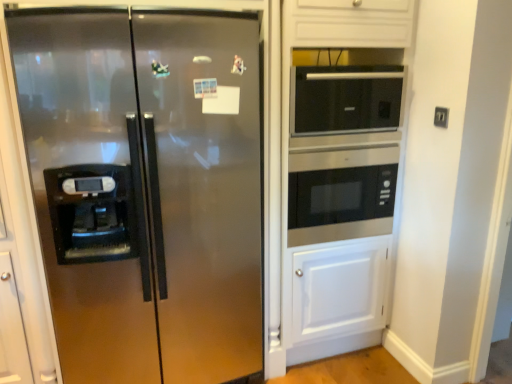
Measure the distance between point (x=306, y=78) and camera.

Point (x=306, y=78) is 1.89 meters from camera.

In order to click on black glass microwave at upper right, which appears as the 2th microwave oven when ordered from the bottom in this screenshot , I will do `click(345, 98)`.

Identify the location of stainless steel refrigerator at left. The height and width of the screenshot is (384, 512). (146, 188).

The height and width of the screenshot is (384, 512). I want to click on black glass microwave at upper right, the first microwave oven positioned from the top, so pyautogui.click(x=345, y=98).

Is stainless steel refrigerator at left oriented towards black plastic electric outlet at upper right?

No, stainless steel refrigerator at left is not facing towards black plastic electric outlet at upper right.

Considering their positions, is stainless steel refrigerator at left located in front of or behind black plastic electric outlet at upper right?

stainless steel refrigerator at left is in front of black plastic electric outlet at upper right.

From the image's perspective, which one is positioned lower, stainless steel refrigerator at left or black plastic electric outlet at upper right?

stainless steel refrigerator at left appears lower in the image.

Does stainless steel refrigerator at left touch black plastic electric outlet at upper right?

No, stainless steel refrigerator at left is not with black plastic electric outlet at upper right.

Does stainless steel refrigerator at left have a greater height compared to black glass microwave at upper right, the first microwave oven positioned from the top?

Yes, stainless steel refrigerator at left is taller than black glass microwave at upper right, the first microwave oven positioned from the top.

From a real-world perspective, is stainless steel refrigerator at left physically below black glass microwave at upper right, the first microwave oven positioned from the top?

Yes.

Considering the positions of objects stainless steel refrigerator at left and black glass microwave at upper right, which appears as the 2th microwave oven when ordered from the bottom, in the image provided, who is more to the left, stainless steel refrigerator at left or black glass microwave at upper right, which appears as the 2th microwave oven when ordered from the bottom,?

stainless steel refrigerator at left is more to the left.

Is stainless steel refrigerator at left outside of black glass microwave at upper right, which appears as the 2th microwave oven when ordered from the bottom?

Absolutely, stainless steel refrigerator at left is external to black glass microwave at upper right, which appears as the 2th microwave oven when ordered from the bottom.

Is point (318, 173) more distant than point (238, 61)?

Yes.

Is stainless steel refrigerator at left at the back of stainless steel microwave at center, the 1th microwave oven ordered from the bottom?

No.

From a real-world perspective, which object stands above the other?

stainless steel microwave at center, the 1th microwave oven ordered from the bottom, is physically above.

How different are the orientations of stainless steel microwave at center, the 1th microwave oven ordered from the bottom, and stainless steel refrigerator at left in degrees?

stainless steel microwave at center, the 1th microwave oven ordered from the bottom, and stainless steel refrigerator at left are facing 0.00336 degrees away from each other.

From the image's perspective, between stainless steel refrigerator at left and stainless steel microwave at center, the 1th microwave oven ordered from the bottom, which one is located above?

From the image's view, stainless steel microwave at center, the 1th microwave oven ordered from the bottom, is above.

Is stainless steel refrigerator at left oriented towards stainless steel microwave at center, the 1th microwave oven ordered from the bottom?

No.

Which point is more forward, (x=239, y=25) or (x=311, y=195)?

The point (x=239, y=25) is closer.

Does stainless steel refrigerator at left have a greater height compared to stainless steel microwave at center, the 1th microwave oven ordered from the bottom?

Correct, stainless steel refrigerator at left is much taller as stainless steel microwave at center, the 1th microwave oven ordered from the bottom.

Is black plastic electric outlet at upper right shorter than stainless steel microwave at center, which is the second microwave oven in top-to-bottom order?

Yes.

Which of these two, black plastic electric outlet at upper right or stainless steel microwave at center, the 1th microwave oven ordered from the bottom, is wider?

stainless steel microwave at center, the 1th microwave oven ordered from the bottom.

Based on the photo, from a real-world perspective, is black plastic electric outlet at upper right positioned under stainless steel microwave at center, the 1th microwave oven ordered from the bottom, based on gravity?

No, from a real-world perspective, black plastic electric outlet at upper right is not beneath stainless steel microwave at center, the 1th microwave oven ordered from the bottom.

From the image's perspective, is black plastic electric outlet at upper right over stainless steel microwave at center, which is the second microwave oven in top-to-bottom order?

Correct, black plastic electric outlet at upper right appears higher than stainless steel microwave at center, which is the second microwave oven in top-to-bottom order, in the image.

Would you say black glass microwave at upper right, which appears as the 2th microwave oven when ordered from the bottom, is inside or outside black plastic electric outlet at upper right?

black glass microwave at upper right, which appears as the 2th microwave oven when ordered from the bottom, cannot be found inside black plastic electric outlet at upper right.

Considering the relative sizes of black glass microwave at upper right, the first microwave oven positioned from the top, and black plastic electric outlet at upper right in the image provided, is black glass microwave at upper right, the first microwave oven positioned from the top, smaller than black plastic electric outlet at upper right?

No, black glass microwave at upper right, the first microwave oven positioned from the top, is not smaller than black plastic electric outlet at upper right.

Is black glass microwave at upper right, the first microwave oven positioned from the top, to the left of black plastic electric outlet at upper right from the viewer's perspective?

Correct, you'll find black glass microwave at upper right, the first microwave oven positioned from the top, to the left of black plastic electric outlet at upper right.

Is black plastic electric outlet at upper right looking in the opposite direction of stainless steel refrigerator at left?

black plastic electric outlet at upper right does not have its back to stainless steel refrigerator at left.

Based on their sizes in the image, would you say black plastic electric outlet at upper right is bigger or smaller than stainless steel refrigerator at left?

black plastic electric outlet at upper right is smaller than stainless steel refrigerator at left.

How many degrees apart are the facing directions of black plastic electric outlet at upper right and stainless steel refrigerator at left?

90 degrees.

Can you confirm if black plastic electric outlet at upper right is thinner than stainless steel refrigerator at left?

Yes, black plastic electric outlet at upper right is thinner than stainless steel refrigerator at left.

Identify the location of refrigerator in front of the black plastic electric outlet at upper right. The width and height of the screenshot is (512, 384). (146, 188).

In order to click on the 2nd microwave oven positioned above the stainless steel refrigerator at left (from a real-world perspective) in this screenshot , I will do `click(345, 98)`.

Considering their positions, is black glass microwave at upper right, which appears as the 2th microwave oven when ordered from the bottom, positioned further to stainless steel refrigerator at left than stainless steel microwave at center, the 1th microwave oven ordered from the bottom?

black glass microwave at upper right, which appears as the 2th microwave oven when ordered from the bottom, lies further to stainless steel refrigerator at left than the other object.

Which object lies nearer to the anchor point black glass microwave at upper right, which appears as the 2th microwave oven when ordered from the bottom, stainless steel microwave at center, which is the second microwave oven in top-to-bottom order, or stainless steel refrigerator at left?

stainless steel microwave at center, which is the second microwave oven in top-to-bottom order, is closer to black glass microwave at upper right, which appears as the 2th microwave oven when ordered from the bottom.

Estimate the real-world distances between objects in this image. Which object is closer to black plastic electric outlet at upper right, stainless steel microwave at center, which is the second microwave oven in top-to-bottom order, or stainless steel refrigerator at left?

stainless steel microwave at center, which is the second microwave oven in top-to-bottom order, lies closer to black plastic electric outlet at upper right than the other object.

Estimate the real-world distances between objects in this image. Which object is closer to black glass microwave at upper right, the first microwave oven positioned from the top, black plastic electric outlet at upper right or stainless steel microwave at center, which is the second microwave oven in top-to-bottom order?

Among the two, stainless steel microwave at center, which is the second microwave oven in top-to-bottom order, is located nearer to black glass microwave at upper right, the first microwave oven positioned from the top.

From the image, which object appears to be farther from black glass microwave at upper right, which appears as the 2th microwave oven when ordered from the bottom, stainless steel refrigerator at left or stainless steel microwave at center, the 1th microwave oven ordered from the bottom?

stainless steel refrigerator at left is further to black glass microwave at upper right, which appears as the 2th microwave oven when ordered from the bottom.

Estimate the real-world distances between objects in this image. Which object is closer to stainless steel refrigerator at left, stainless steel microwave at center, which is the second microwave oven in top-to-bottom order, or black plastic electric outlet at upper right?

Based on the image, stainless steel microwave at center, which is the second microwave oven in top-to-bottom order, appears to be nearer to stainless steel refrigerator at left.

Based on their spatial positions, is stainless steel microwave at center, which is the second microwave oven in top-to-bottom order, or black plastic electric outlet at upper right closer to black glass microwave at upper right, the first microwave oven positioned from the top?

stainless steel microwave at center, which is the second microwave oven in top-to-bottom order.

From the image, which object appears to be nearer to stainless steel refrigerator at left, black plastic electric outlet at upper right or black glass microwave at upper right, the first microwave oven positioned from the top?

Based on the image, black glass microwave at upper right, the first microwave oven positioned from the top, appears to be nearer to stainless steel refrigerator at left.

Identify the location of microwave oven between stainless steel microwave at center, the 1th microwave oven ordered from the bottom, and black plastic electric outlet at upper right from left to right. The image size is (512, 384). (345, 98).

Locate an element on the screen. microwave oven between stainless steel refrigerator at left and black glass microwave at upper right, the first microwave oven positioned from the top, in the horizontal direction is located at coordinates (341, 193).